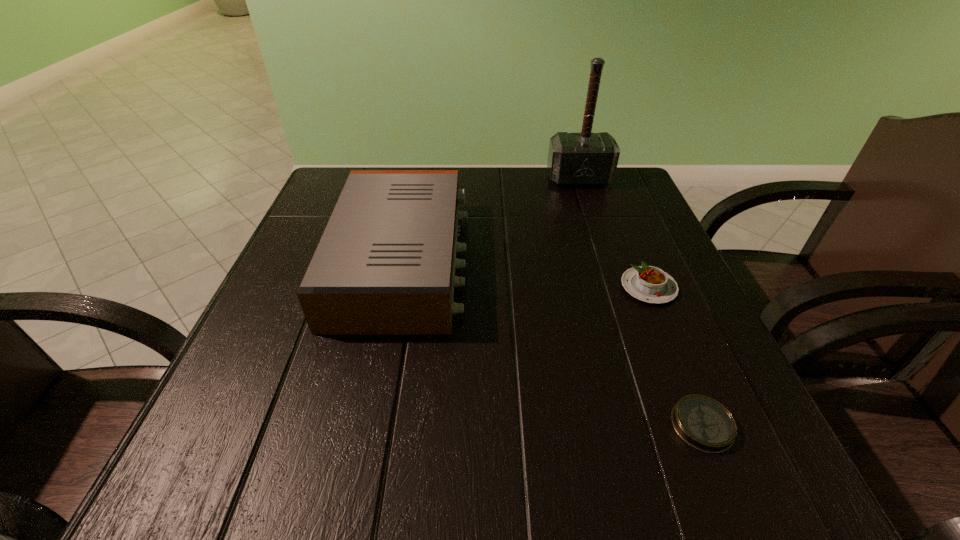
You are a GUI agent. You are given a task and a screenshot of the screen. Output one action in this format:
    pyautogui.click(x=<x>, y=<y>)
    Task: Click on the object present at the near right corner
    
    Given the screenshot: What is the action you would take?
    (x=703, y=423)

In order to click on free space at the far edge of the desktop in this screenshot , I will do `click(480, 186)`.

Find the location of a particular element. This screenshot has width=960, height=540. free space at the left edge is located at coordinates (258, 354).

Locate an element on the screen. The image size is (960, 540). vacant point at the right edge is located at coordinates (662, 240).

In the image, there is a desktop. In order to click on free region at the far right corner in this screenshot , I will do `click(638, 213)`.

Image resolution: width=960 pixels, height=540 pixels. Identify the location of empty space that is in between the farthest object and the leftmost object. (491, 220).

Locate an element on the screen. This screenshot has height=540, width=960. free space between the hammer and the pudding is located at coordinates (613, 233).

Image resolution: width=960 pixels, height=540 pixels. I want to click on free area in between the compass and the tallest object, so [640, 302].

You are a GUI agent. You are given a task and a screenshot of the screen. Output one action in this format:
    pyautogui.click(x=<x>, y=<y>)
    Task: Click on the free space between the hammer and the second shortest object
    This screenshot has width=960, height=540.
    Given the screenshot: What is the action you would take?
    pyautogui.click(x=613, y=233)

Where is `free space between the hammer and the leftmost object`? Image resolution: width=960 pixels, height=540 pixels. free space between the hammer and the leftmost object is located at coordinates (491, 220).